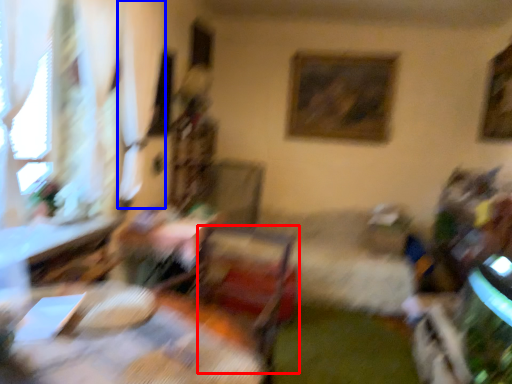
Question: Which point is closer to the camera, swivel chair (highlighted by a red box) or curtain (highlighted by a blue box)?

Choices:
 (A) swivel chair
 (B) curtain

Answer: (A)